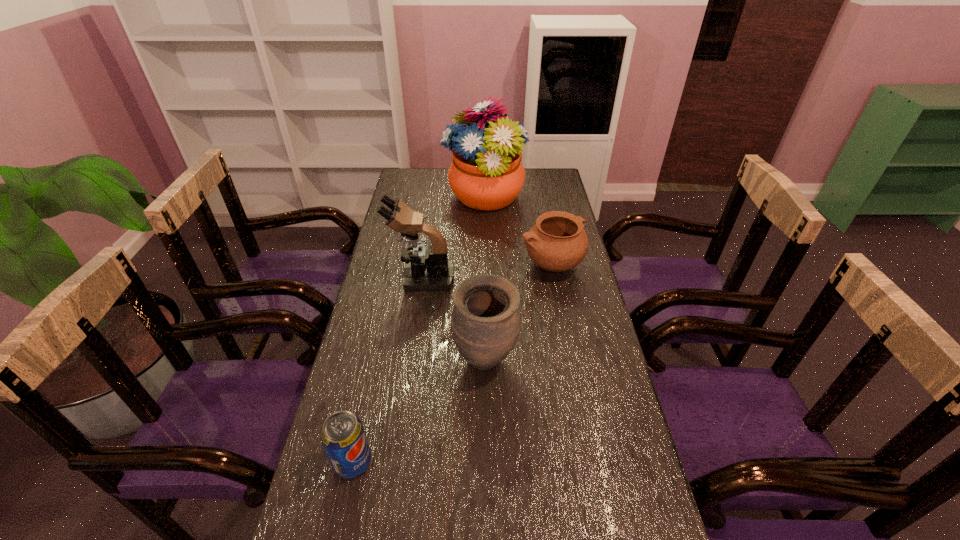
Where is `blank area in the image that satisfies the following two spatial constraints: 1. on the back side of the farthest object; 2. on the right side of the fourth shortest object`? This screenshot has height=540, width=960. blank area in the image that satisfies the following two spatial constraints: 1. on the back side of the farthest object; 2. on the right side of the fourth shortest object is located at coordinates (434, 198).

What are the coordinates of `vacant space that satisfies the following two spatial constraints: 1. on the back side of the nearest object; 2. on the left side of the third shortest object` in the screenshot? It's located at (375, 361).